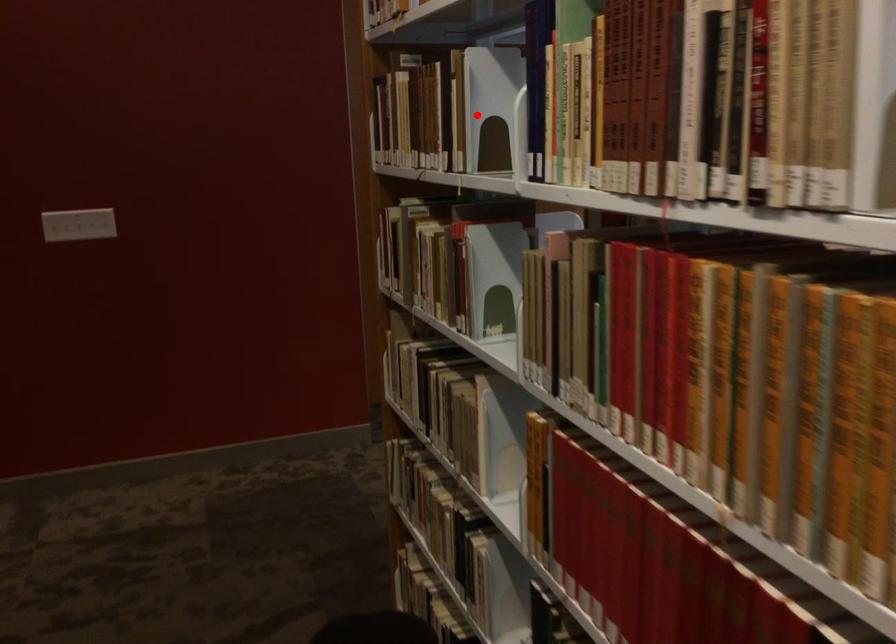
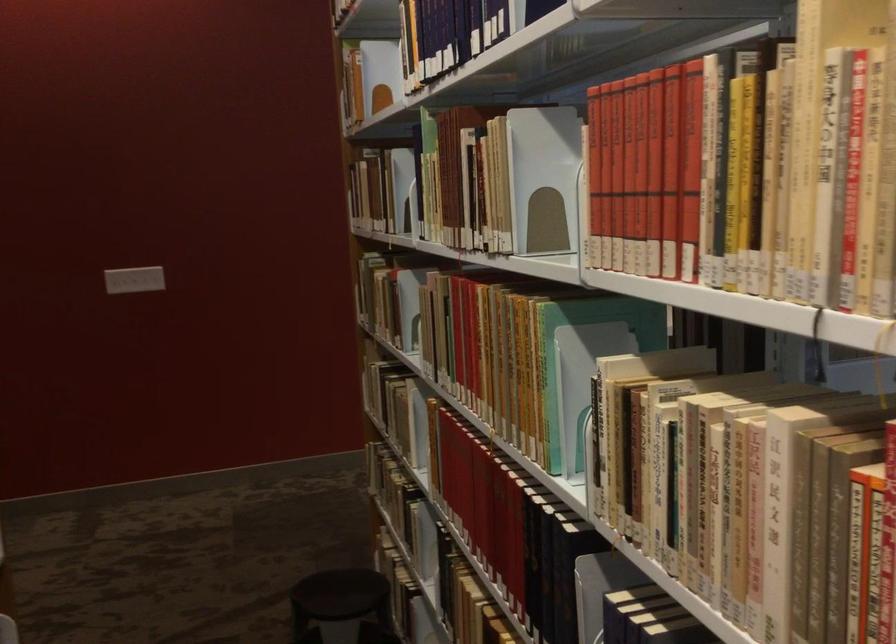
Question: I am providing you with two images of the same scene from different viewpoints. In image1, a red point is highlighted. Considering the same 3D point in image2, which of the following is correct?

Choices:
 (A) It is closer
 (B) It is farther

Answer: (B)